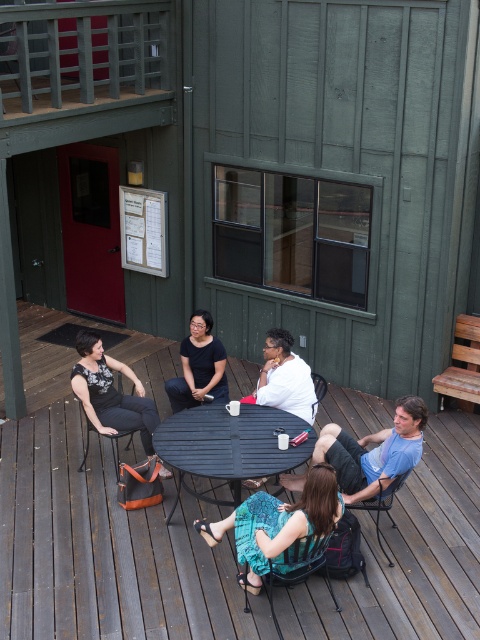
Which of these two, blue patterned dress at center or metallic black chair at lower right, stands taller?

Standing taller between the two is blue patterned dress at center.

What do you see at coordinates (280, 525) in the screenshot? Image resolution: width=480 pixels, height=640 pixels. I see `blue patterned dress at center` at bounding box center [280, 525].

Which is in front, point (301, 556) or point (379, 484)?

Positioned in front is point (301, 556).

Image resolution: width=480 pixels, height=640 pixels. Find the location of `blue patterned dress at center`. blue patterned dress at center is located at coordinates (280, 525).

Based on the photo, between metallic black chair at lower center and matte black chair at lower left, which one has more height?

With more height is matte black chair at lower left.

Can you confirm if metallic black chair at lower center is shorter than matte black chair at lower left?

Yes, metallic black chair at lower center is shorter than matte black chair at lower left.

This screenshot has width=480, height=640. In order to click on metallic black chair at lower center in this screenshot , I will do `click(296, 582)`.

Can you confirm if blue patterned dress at center is shorter than metallic silver chair at center?

In fact, blue patterned dress at center may be taller than metallic silver chair at center.

Between point (268, 541) and point (317, 390), which one is positioned in front?

Point (268, 541)

Find the location of `blue patterned dress at center`. blue patterned dress at center is located at coordinates (280, 525).